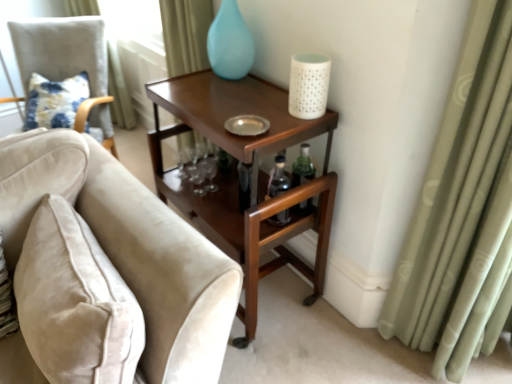
Where is `vacant space underneath matte blue glass vase at upper center (from a real-world perspective)`? The height and width of the screenshot is (384, 512). vacant space underneath matte blue glass vase at upper center (from a real-world perspective) is located at coordinates (242, 81).